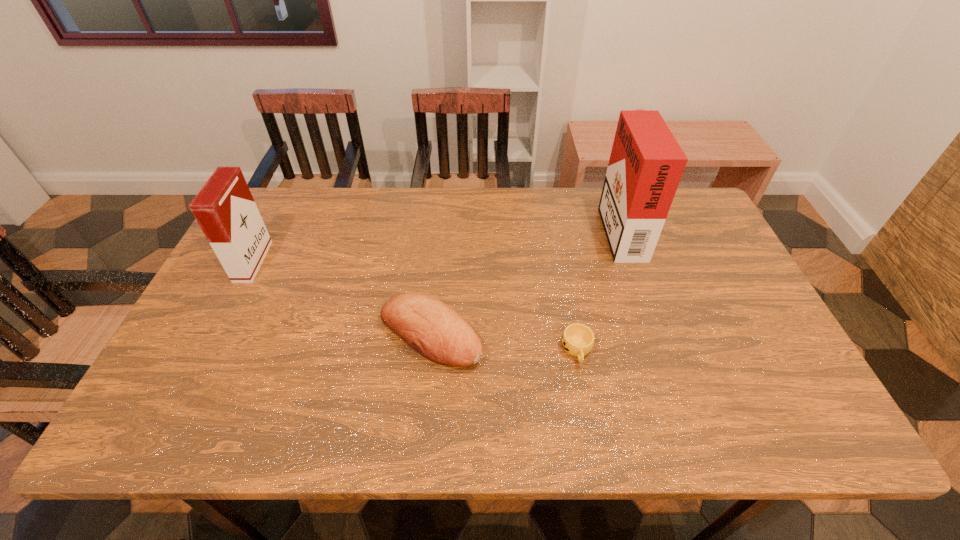
Locate an element on the screen. This screenshot has width=960, height=540. vacant space located 0.060m on the front-facing side of the tallest object is located at coordinates (585, 227).

The width and height of the screenshot is (960, 540). What are the coordinates of `vacant region located on the front-facing side of the shorter cigarette_case` in the screenshot? It's located at (396, 261).

Identify the location of vacant space located 0.350m on the back of the bread. This screenshot has height=540, width=960. [442, 220].

In order to click on vacant space located 0.210m on the back of the shortest object in this screenshot , I will do `click(563, 274)`.

At what (x,y) coordinates should I click in order to perform the action: click on object situated at the far edge. Please return your answer as a coordinate pair (x, y). Looking at the image, I should click on (646, 164).

At what (x,y) coordinates should I click in order to perform the action: click on object at the left edge. Please return your answer as a coordinate pair (x, y). Looking at the image, I should click on (224, 208).

Locate an element on the screen. This screenshot has width=960, height=540. free space at the far edge is located at coordinates (381, 231).

In the image, there is a desktop. Where is `free region at the near edge`? Image resolution: width=960 pixels, height=540 pixels. free region at the near edge is located at coordinates (587, 436).

Locate an element on the screen. vacant area at the left edge is located at coordinates (233, 316).

In the image, there is a desktop. Where is `vacant space at the right edge`? The width and height of the screenshot is (960, 540). vacant space at the right edge is located at coordinates (762, 369).